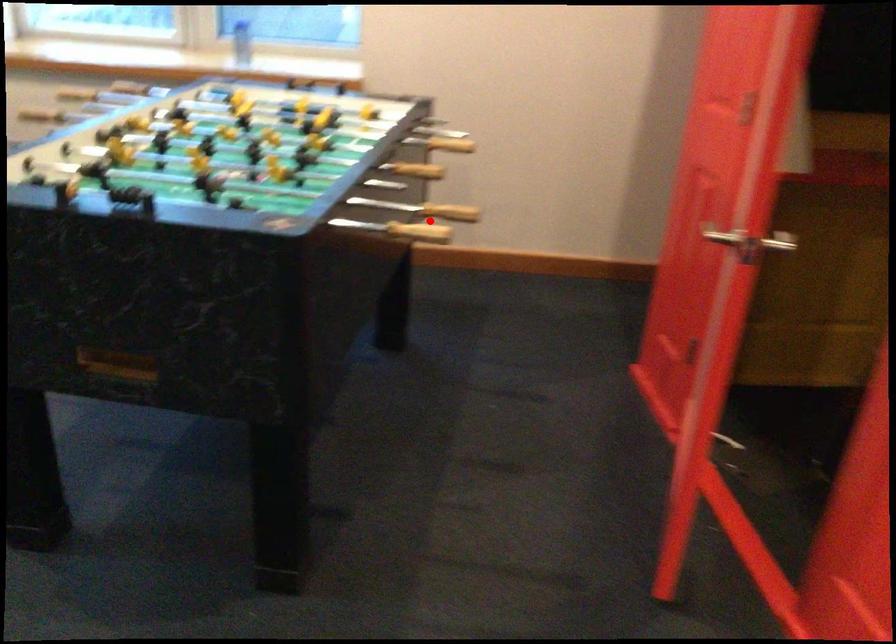
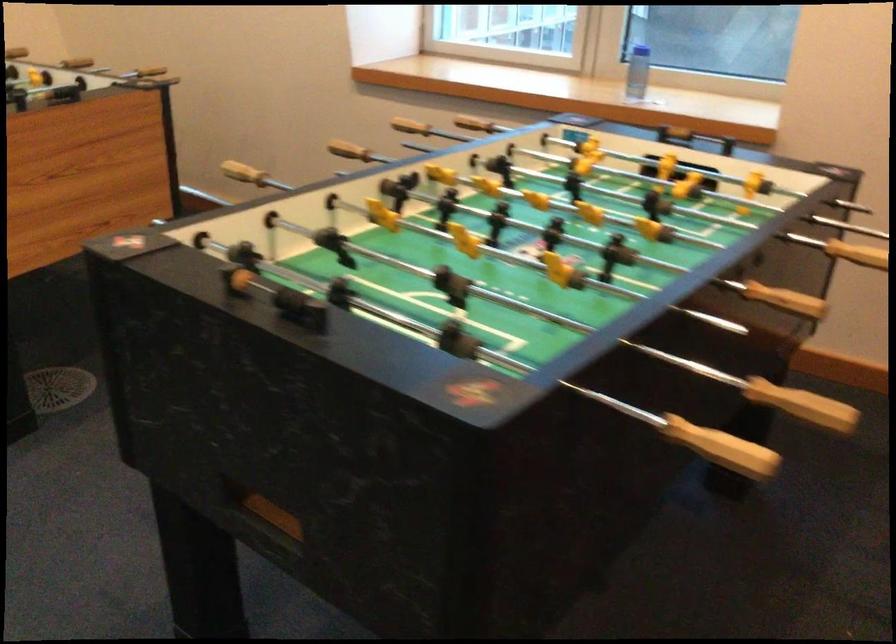
Question: I am providing you with two images of the same scene from different viewpoints. In image1, a red point is highlighted. Considering the same 3D point in image2, which of the following is correct?

Choices:
 (A) It is closer
 (B) It is farther

Answer: (A)